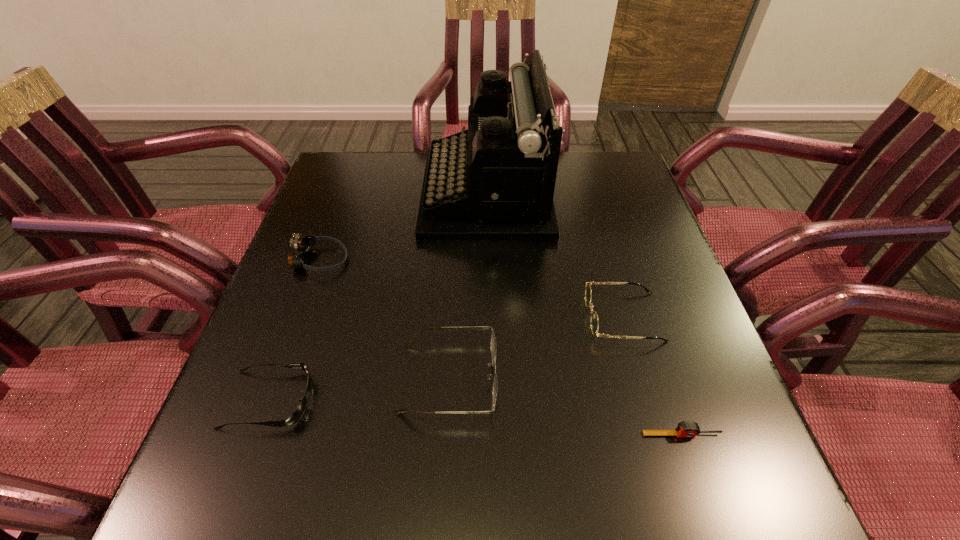
I want to click on spectacles that is at the right edge, so click(594, 322).

At what (x,y) coordinates should I click in order to perform the action: click on tape measure at the right edge. Please return your answer as a coordinate pair (x, y). Image resolution: width=960 pixels, height=540 pixels. Looking at the image, I should click on (685, 429).

The image size is (960, 540). Find the location of `free spot at the far edge of the desktop`. free spot at the far edge of the desktop is located at coordinates (562, 191).

Where is `vacant space at the left edge`? vacant space at the left edge is located at coordinates (221, 420).

You are a GUI agent. You are given a task and a screenshot of the screen. Output one action in this format:
    pyautogui.click(x=<x>, y=<y>)
    Task: Click on the vacant position at the right edge of the desktop
    The image size is (960, 540).
    Given the screenshot: What is the action you would take?
    pyautogui.click(x=695, y=440)

In the image, there is a desktop. Where is `free space at the far left corner`? free space at the far left corner is located at coordinates (355, 174).

I want to click on vacant space at the near left corner of the desktop, so click(268, 475).

This screenshot has width=960, height=540. In the image, there is a desktop. Find the location of `vacant region at the far right corner`. vacant region at the far right corner is located at coordinates (587, 197).

Where is `empty space that is in between the goggles and the right spectacles`? empty space that is in between the goggles and the right spectacles is located at coordinates (471, 288).

Where is `vacant region between the right spectacles and the left spectacles`? This screenshot has width=960, height=540. vacant region between the right spectacles and the left spectacles is located at coordinates (536, 348).